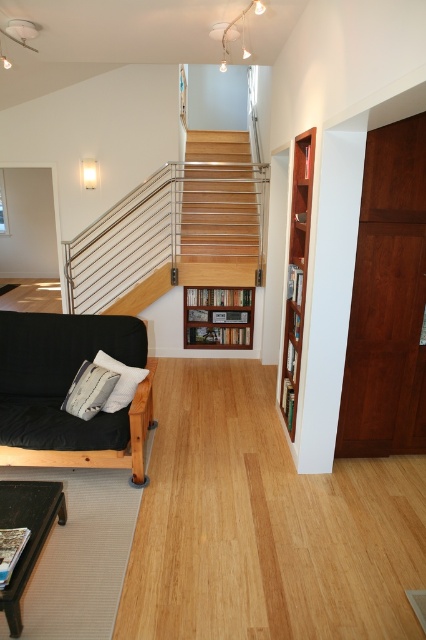
Question: Which of the following is the farthest from the observer?

Choices:
 (A) black wood futon at lower left
 (B) wooden stairs at center
 (C) wooden stair at center
 (D) wooden bookshelf at center

Answer: (D)

Question: Estimate the real-world distances between objects in this image. Which object is farther from the wooden stairs at center?

Choices:
 (A) wooden stair at center
 (B) wooden bookshelf at right
 (C) black wood futon at lower left
 (D) white soft pillow at left

Answer: (D)

Question: Which point is closer to the camera?

Choices:
 (A) (196, 141)
 (B) (169, 285)
 (C) (114, 406)

Answer: (C)

Question: Does wooden bookshelf at right have a smaller size compared to wooden bookshelf at center?

Choices:
 (A) yes
 (B) no

Answer: (B)

Question: Is wooden stair at center above black wood futon at lower left?

Choices:
 (A) yes
 (B) no

Answer: (A)

Question: Is wooden stair at center thinner than wooden stairs at center?

Choices:
 (A) yes
 (B) no

Answer: (B)